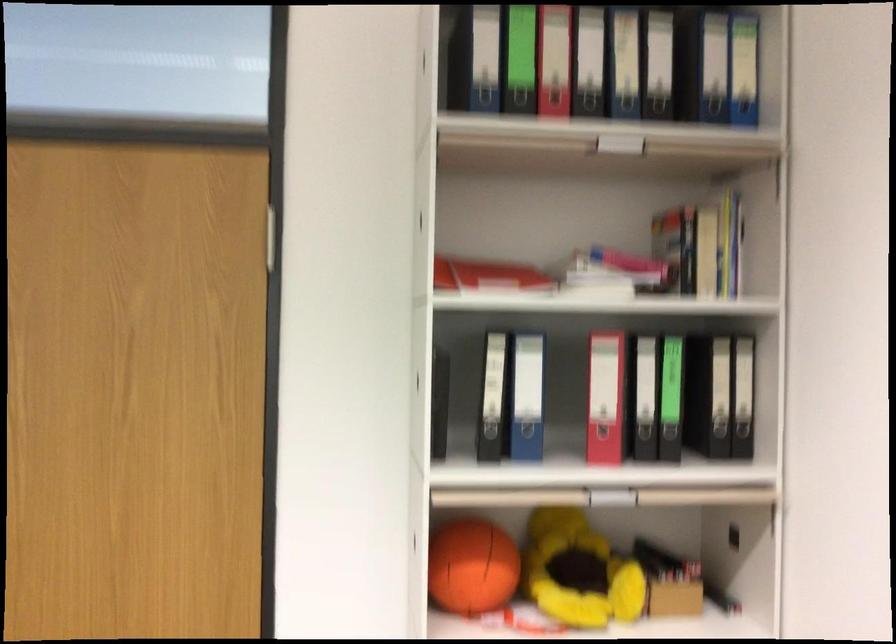
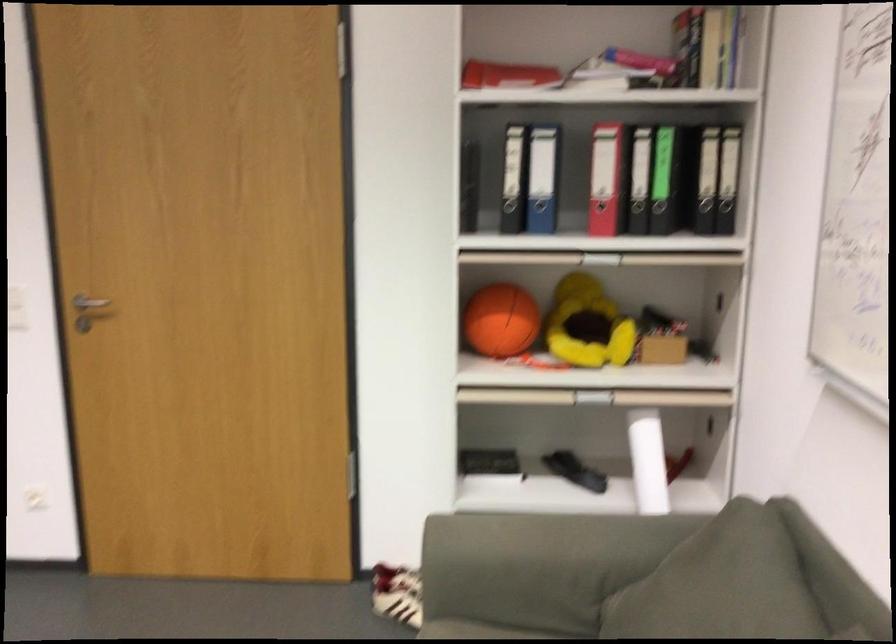
Find the pixel in the second image that matches (479,272) in the first image.

(506, 75)